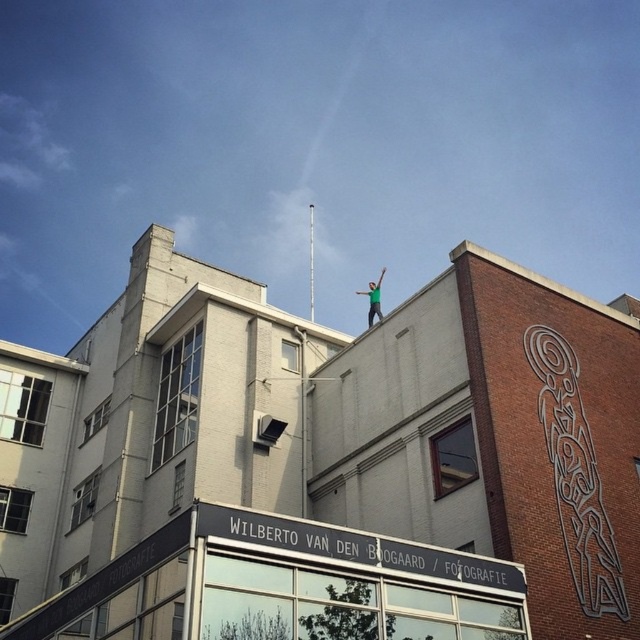
Between white glossy pole at upper center and green fabric person at upper center, which one has less height?

With less height is green fabric person at upper center.

Is point (312, 292) positioned in front of point (378, 292)?

No, (312, 292) is behind (378, 292).

This screenshot has height=640, width=640. Describe the element at coordinates (310, 260) in the screenshot. I see `white glossy pole at upper center` at that location.

At what (x,y) coordinates should I click in order to perform the action: click on white glossy pole at upper center. Please return your answer as a coordinate pair (x, y). The image size is (640, 640). Looking at the image, I should click on (310, 260).